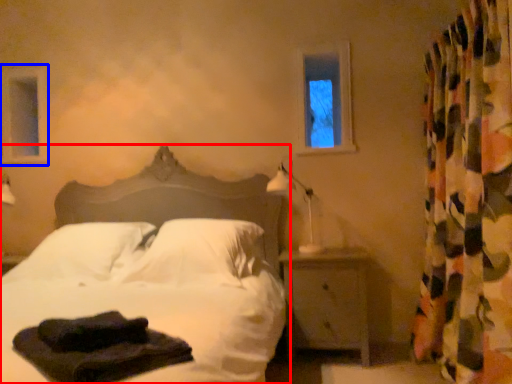
Question: Which object is closer to the camera taking this photo, bed (highlighted by a red box) or window frame (highlighted by a blue box)?

Choices:
 (A) bed
 (B) window frame

Answer: (A)